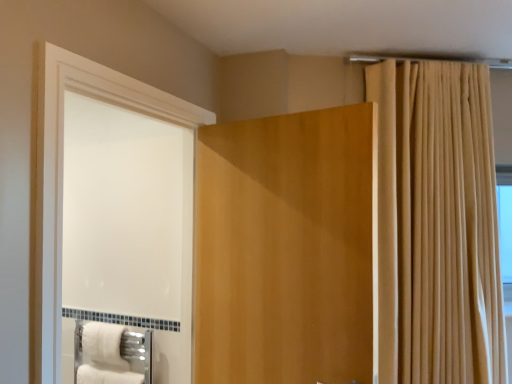
Measure the distance between point (458, 210) and camera.

The depth of point (458, 210) is 2.07 meters.

Describe the element at coordinates (437, 224) in the screenshot. I see `beige fabric curtain at upper right` at that location.

The height and width of the screenshot is (384, 512). What do you see at coordinates (62, 171) in the screenshot? I see `white glossy screen door at left` at bounding box center [62, 171].

The image size is (512, 384). Find the location of `beige fabric curtain at upper right`. beige fabric curtain at upper right is located at coordinates (437, 224).

Is white glossy screen door at left located outside matte wood door at center?

white glossy screen door at left lies outside matte wood door at center's area.

Is white glossy screen door at left bigger or smaller than matte wood door at center?

Clearly, white glossy screen door at left is smaller in size than matte wood door at center.

From the image's perspective, is white glossy screen door at left located beneath matte wood door at center?

Incorrect, from the image's perspective, white glossy screen door at left is higher than matte wood door at center.

From a real-world perspective, is white glossy screen door at left below matte wood door at center?

No, from a real-world perspective, white glossy screen door at left is not under matte wood door at center.

Between matte wood door at center and white fluffy bath towel at lower left, which one has larger size?

With larger size is matte wood door at center.

From a real-world perspective, is matte wood door at center physically above white fluffy bath towel at lower left?

Yes.

Which object is closer to the camera, matte wood door at center or white fluffy bath towel at lower left?

Positioned in front is matte wood door at center.

Is point (398, 212) behind point (103, 328)?

No, (398, 212) is closer to viewer.

Does beige fabric curtain at upper right appear on the left side of white fluffy bath towel at lower left?

No.

Is beige fabric curtain at upper right situated inside white fluffy bath towel at lower left or outside?

beige fabric curtain at upper right exists outside the volume of white fluffy bath towel at lower left.

From the image's perspective, is beige fabric curtain at upper right located above or below white fluffy bath towel at lower left?

Clearly, from the image's perspective, beige fabric curtain at upper right is above white fluffy bath towel at lower left.

Is matte wood door at center touching white glossy screen door at left?

No, matte wood door at center is not making contact with white glossy screen door at left.

Is matte wood door at center completely or partially outside of white glossy screen door at left?

Indeed, matte wood door at center is completely outside white glossy screen door at left.

Does matte wood door at center come behind white glossy screen door at left?

That is True.

Between matte wood door at center and white glossy screen door at left, which one has larger width?

Wider between the two is matte wood door at center.

From the image's perspective, is white glossy screen door at left located above or below white fluffy bath towel at lower left?

Result: white glossy screen door at left is situated higher than white fluffy bath towel at lower left in the image.

Does white glossy screen door at left lie behind white fluffy bath towel at lower left?

No, it is not.

Is white glossy screen door at left outside of white fluffy bath towel at lower left?

white glossy screen door at left lies outside white fluffy bath towel at lower left's area.

Which of these two, beige fabric curtain at upper right or white glossy screen door at left, stands shorter?

With less height is white glossy screen door at left.

Does beige fabric curtain at upper right have a greater width compared to white glossy screen door at left?

Yes, beige fabric curtain at upper right is wider than white glossy screen door at left.

Is there a large distance between beige fabric curtain at upper right and white glossy screen door at left?

beige fabric curtain at upper right is positioned a significant distance from white glossy screen door at left.

From the image's perspective, does beige fabric curtain at upper right appear lower than white glossy screen door at left?

No.

Is white fluffy bath towel at lower left oriented away from white glossy screen door at left?

No, white fluffy bath towel at lower left is not facing the opposite direction of white glossy screen door at left.

Considering the sizes of objects white fluffy bath towel at lower left and white glossy screen door at left in the image provided, who is bigger, white fluffy bath towel at lower left or white glossy screen door at left?

Bigger between the two is white glossy screen door at left.

Would you consider white fluffy bath towel at lower left to be distant from white glossy screen door at left?

Actually, white fluffy bath towel at lower left and white glossy screen door at left are a little close together.

The image size is (512, 384). What are the coordinates of `screen door lying on the left of matte wood door at center` in the screenshot? It's located at (62, 171).

Locate an element on the screen. The height and width of the screenshot is (384, 512). bath towel below the matte wood door at center (from a real-world perspective) is located at coordinates (104, 345).

From the image, which object appears to be farther from matte wood door at center, white glossy screen door at left or white fluffy bath towel at lower left?

white fluffy bath towel at lower left is further to matte wood door at center.

Estimate the real-world distances between objects in this image. Which object is further from white glossy screen door at left, white fluffy bath towel at lower left or matte wood door at center?

Among the two, white fluffy bath towel at lower left is located further to white glossy screen door at left.

When comparing their distances from beige fabric curtain at upper right, does white glossy screen door at left or matte wood door at center seem closer?

matte wood door at center is positioned closer to the anchor beige fabric curtain at upper right.

When comparing their distances from beige fabric curtain at upper right, does matte wood door at center or white glossy screen door at left seem closer?

matte wood door at center.

From the image, which object appears to be nearer to beige fabric curtain at upper right, matte wood door at center or white fluffy bath towel at lower left?

Among the two, matte wood door at center is located nearer to beige fabric curtain at upper right.

Estimate the real-world distances between objects in this image. Which object is further from white glossy screen door at left, matte wood door at center or beige fabric curtain at upper right?

beige fabric curtain at upper right is positioned further to the anchor white glossy screen door at left.

Based on their spatial positions, is white fluffy bath towel at lower left or white glossy screen door at left further from matte wood door at center?

The object further to matte wood door at center is white fluffy bath towel at lower left.

Looking at the image, which one is located further to white fluffy bath towel at lower left, beige fabric curtain at upper right or matte wood door at center?

The object further to white fluffy bath towel at lower left is beige fabric curtain at upper right.

Find the location of `door between white fluffy bath towel at lower left and beige fabric curtain at upper right`. door between white fluffy bath towel at lower left and beige fabric curtain at upper right is located at coordinates (285, 249).

Locate an element on the screen. The image size is (512, 384). door situated between white glossy screen door at left and beige fabric curtain at upper right from left to right is located at coordinates (285, 249).

The width and height of the screenshot is (512, 384). I want to click on door positioned between white glossy screen door at left and white fluffy bath towel at lower left from near to far, so click(285, 249).

Where is `screen door between white fluffy bath towel at lower left and beige fabric curtain at upper right from left to right`? The image size is (512, 384). screen door between white fluffy bath towel at lower left and beige fabric curtain at upper right from left to right is located at coordinates (62, 171).